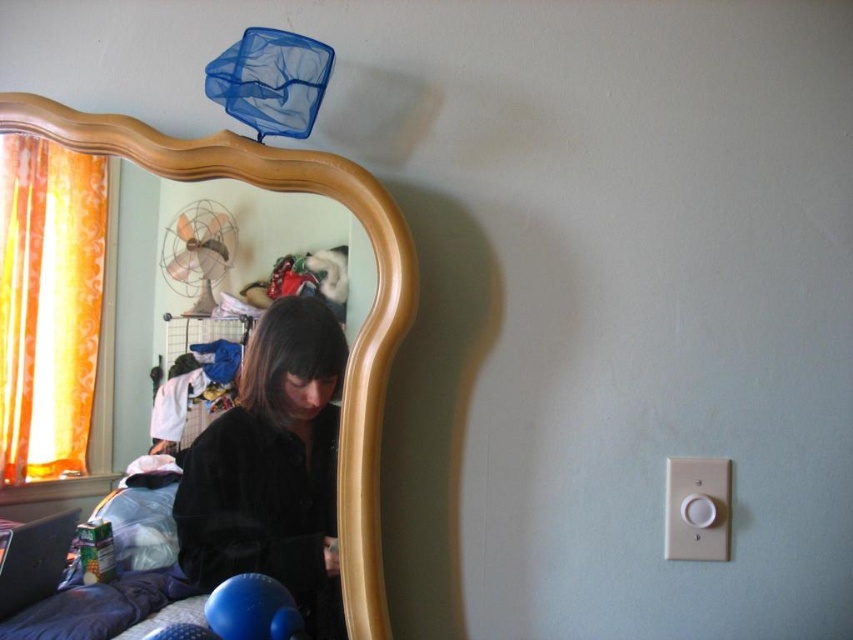
You are organizing a small party and need to place a decorative item on the wooden mirror at left. However, you also have a black plastic laptop at lower left where you want to put another decoration. Considering their sizes, which surface can accommodate a larger decoration?

The wooden mirror at left has a larger width than the black plastic laptop at lower left, so it can accommodate a larger decoration.

You are standing in the room and want to place a new painting on the wall. The painting must be placed exactly at the same 2D coordinates as the black velvet coat at center. Where should you place the painting?

Place the painting at the coordinates point (271, 468) where the black velvet coat at center was located.

You are organizing a space in the room and need to place the black plastic laptop at lower left on a shelf. The shelf can only hold items that are shorter than the wooden mirror at left. Can the laptop fit on the shelf?

The wooden mirror at left has a greater height compared to the black plastic laptop at lower left. Since the shelf requires items shorter than the mirror, the black plastic laptop at lower left can fit on the shelf because it is shorter.